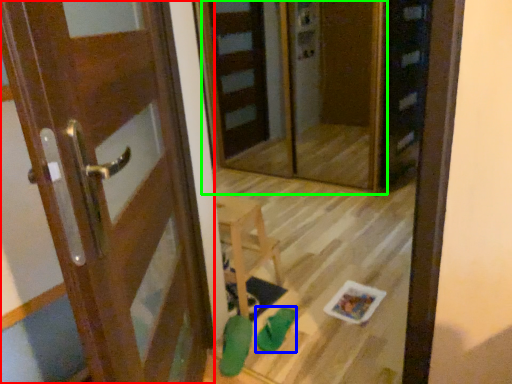
Question: Estimate the real-world distances between objects in this image. Which object is farther from door (highlighted by a red box), shoe (highlighted by a blue box) or screen door (highlighted by a green box)?

Choices:
 (A) shoe
 (B) screen door

Answer: (B)